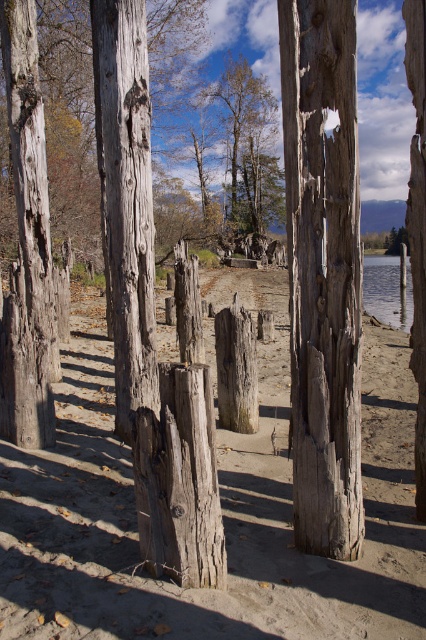
Question: Which point is farther from the camera taking this photo?

Choices:
 (A) (232, 97)
 (B) (304, 524)
 (C) (380, 461)

Answer: (A)

Question: Where is weathered wood post at center located in relation to weathered wood at center in the image?

Choices:
 (A) left
 (B) right

Answer: (B)

Question: Is weathered wood post at center wider than green leafy tree at center?

Choices:
 (A) yes
 (B) no

Answer: (B)

Question: Estimate the real-world distances between objects in this image. Which object is farther from the clear water at lower right?

Choices:
 (A) green leafy tree at center
 (B) weathered wood posts at center
 (C) weathered wood at center

Answer: (A)

Question: Is weathered wood post at center positioned before clear water at lower right?

Choices:
 (A) no
 (B) yes

Answer: (B)

Question: Which object is farther from the camera taking this photo?

Choices:
 (A) weathered wood post at center
 (B) clear water at lower right
 (C) green leafy tree at center

Answer: (C)